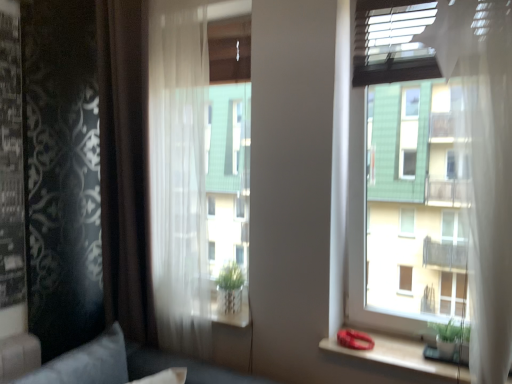
Question: Does brown sheer curtain at left, positioned as the 1th curtain in left-to-right order, have a lesser height compared to velvet gray pillow at lower left?

Choices:
 (A) yes
 (B) no

Answer: (B)

Question: Does brown sheer curtain at left, positioned as the 1th curtain in left-to-right order, have a greater width compared to velvet gray pillow at lower left?

Choices:
 (A) no
 (B) yes

Answer: (A)

Question: Does brown sheer curtain at left, positioned as the 1th curtain in left-to-right order, have a lesser width compared to velvet gray pillow at lower left?

Choices:
 (A) no
 (B) yes

Answer: (B)

Question: Is brown sheer curtain at left, which is the 2th curtain from right to left, to the right of velvet gray pillow at lower left from the viewer's perspective?

Choices:
 (A) no
 (B) yes

Answer: (B)

Question: Does brown sheer curtain at left, which is the 2th curtain from right to left, have a smaller size compared to velvet gray pillow at lower left?

Choices:
 (A) no
 (B) yes

Answer: (A)

Question: Is velvet gray pillow at lower left wider or thinner than wooden at right?

Choices:
 (A) wide
 (B) thin

Answer: (A)

Question: From a real-world perspective, is velvet gray pillow at lower left positioned above or below wooden at right?

Choices:
 (A) above
 (B) below

Answer: (B)

Question: Based on their sizes in the image, would you say velvet gray pillow at lower left is bigger or smaller than wooden at right?

Choices:
 (A) big
 (B) small

Answer: (A)

Question: Is velvet gray pillow at lower left taller or shorter than wooden at right?

Choices:
 (A) short
 (B) tall

Answer: (B)

Question: Is brown sheer curtain at left, positioned as the 1th curtain in left-to-right order, wider or thinner than velvet gray pillow at lower left?

Choices:
 (A) wide
 (B) thin

Answer: (B)

Question: In terms of size, does brown sheer curtain at left, positioned as the 1th curtain in left-to-right order, appear bigger or smaller than velvet gray pillow at lower left?

Choices:
 (A) small
 (B) big

Answer: (B)

Question: Considering the relative positions of brown sheer curtain at left, which is the 2th curtain from right to left, and velvet gray pillow at lower left in the image provided, is brown sheer curtain at left, which is the 2th curtain from right to left, to the left or to the right of velvet gray pillow at lower left?

Choices:
 (A) right
 (B) left

Answer: (A)

Question: From their relative heights in the image, would you say brown sheer curtain at left, which is the 2th curtain from right to left, is taller or shorter than velvet gray pillow at lower left?

Choices:
 (A) short
 (B) tall

Answer: (B)

Question: From a real-world perspective, is velvet gray pillow at lower left physically located above or below transparent glass window at upper right?

Choices:
 (A) below
 (B) above

Answer: (A)

Question: Is velvet gray pillow at lower left wider or thinner than transparent glass window at upper right?

Choices:
 (A) thin
 (B) wide

Answer: (B)